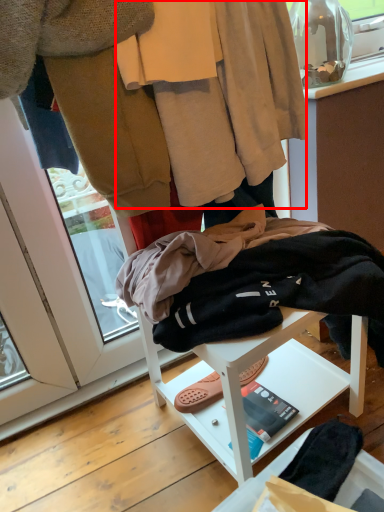
Question: Observing the image, what is the correct spatial positioning of robe (annotated by the red box) in reference to furniture?

Choices:
 (A) right
 (B) left

Answer: (B)